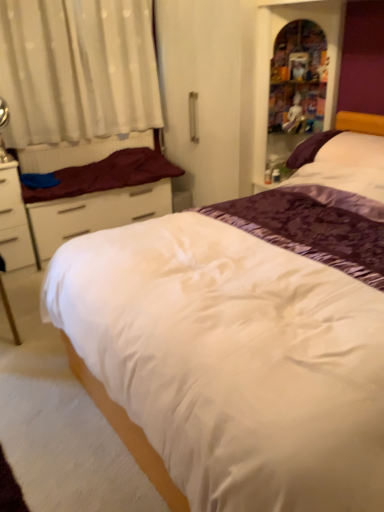
Question: Does point (332, 147) appear closer or farther from the camera than point (62, 182)?

Choices:
 (A) farther
 (B) closer

Answer: (B)

Question: Based on their positions, is purple satin pillow at upper right located to the left or right of maroon fabric mattress at left?

Choices:
 (A) right
 (B) left

Answer: (A)

Question: Estimate the real-world distances between objects in this image. Which object is closer to the maroon fabric mattress at left?

Choices:
 (A) wooden bookshelf at upper right
 (B) white satin bed at center
 (C) purple satin pillow at upper right
 (D) white sheer curtain at upper left
 (E) white matte drawer at left

Answer: (E)

Question: Which object is positioned closest to the white sheer curtain at upper left?

Choices:
 (A) wooden bookshelf at upper right
 (B) purple satin pillow at upper right
 (C) metallic silver table lamp at left
 (D) white satin bed at center
 (E) maroon fabric mattress at left

Answer: (E)